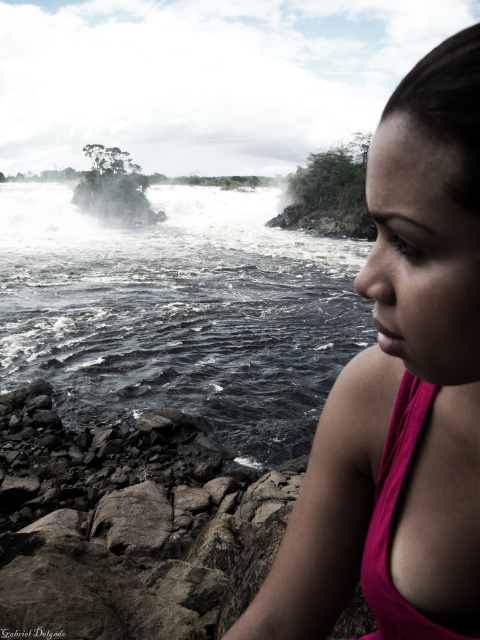
You are standing in the scene and want to reach the point at coordinates point (x=474, y=280) and point (x=259, y=422). Which point is closer to you?

Point (x=474, y=280) is closer to the camera than point (x=259, y=422), so you will reach point (x=474, y=280) first.

You are a photographer standing in the scene and want to capture both the pink fabric at center and the dark gray rocky river at lower left in your shot. Which object will appear larger in the photo?

The pink fabric at center will appear larger in the photo because it is closer to the viewer than the dark gray rocky river at lower left.